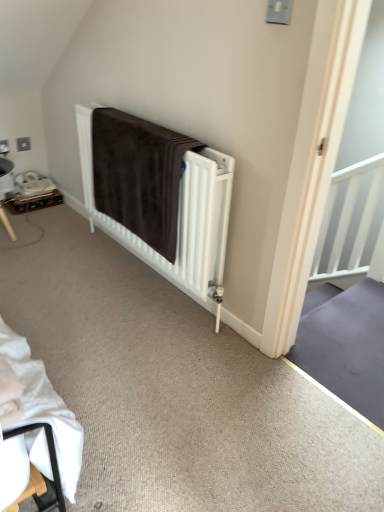
What do you see at coordinates (158, 195) in the screenshot?
I see `brown fabric bed at center` at bounding box center [158, 195].

The image size is (384, 512). What do you see at coordinates (31, 201) in the screenshot?
I see `wooden tray at left` at bounding box center [31, 201].

Identify the location of brown fabric bed at center. (158, 195).

Which is closer to the camera, (x=156, y=194) or (x=11, y=197)?

The point (x=156, y=194) is in front.

Between brown plush blanket at center and wooden tray at left, which one has smaller size?

Smaller between the two is wooden tray at left.

Find the location of a particular element. table directly beneath the brown plush blanket at center (from a real-world perspective) is located at coordinates (31, 201).

Is brown plush blanket at center positioned with its back to wooden tray at left?

brown plush blanket at center is not turned away from wooden tray at left.

Find the location of a particular element. table that is under the brown plush blanket at center (from a real-world perspective) is located at coordinates (31, 201).

Are wooden tray at left and brown plush blanket at center beside each other?

wooden tray at left is not next to brown plush blanket at center, and they're not touching.

Which is more to the left, wooden tray at left or brown plush blanket at center?

wooden tray at left.

From the image's perspective, which is below, wooden tray at left or brown fabric bed at center?

brown fabric bed at center, from the image's perspective.

Which is behind, point (47, 197) or point (226, 206)?

The point (47, 197) is farther from the camera.

Locate an element on the screen. Image resolution: width=384 pixels, height=512 pixels. table above the brown fabric bed at center (from the image's perspective) is located at coordinates (31, 201).

Can you tell me how much wooden tray at left and brown fabric bed at center differ in facing direction?

The angular difference between wooden tray at left and brown fabric bed at center is 90.7 degrees.

Is brown plush blanket at center spatially inside brown fabric bed at center, or outside of it?

brown plush blanket at center fits inside brown fabric bed at center.

From the image's perspective, is brown plush blanket at center located beneath brown fabric bed at center?

No, from the image's perspective, brown plush blanket at center is not below brown fabric bed at center.

Is brown plush blanket at center bigger than brown fabric bed at center?

No, brown plush blanket at center is not bigger than brown fabric bed at center.

Is brown plush blanket at center beside brown fabric bed at center?

Yes, brown plush blanket at center is with brown fabric bed at center.

Can you see brown fabric bed at center touching brown plush blanket at center?

Absolutely, brown fabric bed at center is next to and touching brown plush blanket at center.

Is brown fabric bed at center wider than brown plush blanket at center?

No, brown fabric bed at center is not wider than brown plush blanket at center.

I want to click on bed located on the left of brown plush blanket at center, so 158,195.

Based on their positions, is brown fabric bed at center located to the left or right of brown plush blanket at center?

Based on their positions, brown fabric bed at center is located to the left of brown plush blanket at center.

How much distance is there between brown fabric bed at center and wooden tray at left?

brown fabric bed at center and wooden tray at left are 1.19 meters apart from each other.

Considering the relative positions of brown fabric bed at center and wooden tray at left in the image provided, is brown fabric bed at center behind wooden tray at left?

No.

Looking at this image, is the surface of brown fabric bed at center in direct contact with wooden tray at left?

No, brown fabric bed at center is not touching wooden tray at left.

From the image's perspective, is brown fabric bed at center on wooden tray at left?

No, from the image's perspective, brown fabric bed at center is not above wooden tray at left.

You are a GUI agent. You are given a task and a screenshot of the screen. Output one action in this format:
    pyautogui.click(x=<x>, y=<y>)
    Task: Click on the table above the brown plush blanket at center (from the image's perspective)
    
    Given the screenshot: What is the action you would take?
    pyautogui.click(x=31, y=201)

In the image, there is a brown plush blanket at center. At what (x,y) coordinates should I click in order to perform the action: click on table below it (from a real-world perspective). Please return your answer as a coordinate pair (x, y). Image resolution: width=384 pixels, height=512 pixels. Looking at the image, I should click on (x=31, y=201).

Looking at the image, which one is located closer to wooden tray at left, brown plush blanket at center or brown fabric bed at center?

Among the two, brown plush blanket at center is located nearer to wooden tray at left.

When comparing their distances from brown fabric bed at center, does brown plush blanket at center or wooden tray at left seem further?

wooden tray at left.

Considering their positions, is wooden tray at left positioned further to brown plush blanket at center than brown fabric bed at center?

wooden tray at left is further to brown plush blanket at center.

Which object lies nearer to the anchor point brown fabric bed at center, wooden tray at left or brown plush blanket at center?

Based on the image, brown plush blanket at center appears to be nearer to brown fabric bed at center.

Estimate the real-world distances between objects in this image. Which object is further from wooden tray at left, brown fabric bed at center or brown plush blanket at center?

brown fabric bed at center is positioned further to the anchor wooden tray at left.

Considering their positions, is brown fabric bed at center positioned closer to brown plush blanket at center than wooden tray at left?

brown fabric bed at center lies closer to brown plush blanket at center than the other object.

Where is `blanket positioned between brown fabric bed at center and wooden tray at left from near to far`? This screenshot has height=512, width=384. blanket positioned between brown fabric bed at center and wooden tray at left from near to far is located at coordinates (139, 175).